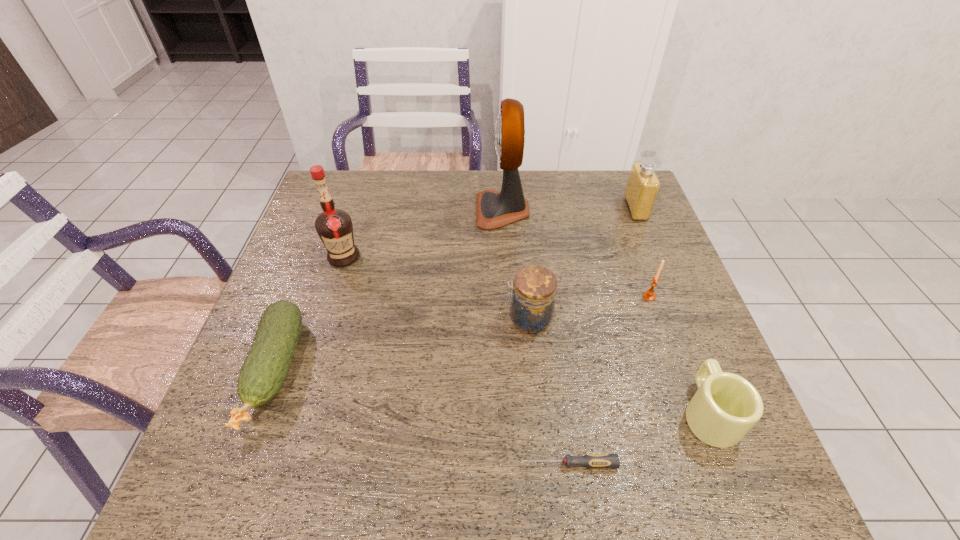
The image size is (960, 540). What are the coordinates of `vacant space that is in between the liquor and the jar` in the screenshot? It's located at (436, 288).

Locate an element on the screen. The height and width of the screenshot is (540, 960). vacant region between the mug and the liquor is located at coordinates (526, 335).

You are a GUI agent. You are given a task and a screenshot of the screen. Output one action in this format:
    pyautogui.click(x=<x>, y=<y>)
    Task: Click on the free area in between the jar and the screwdriver
    The width and height of the screenshot is (960, 540).
    Given the screenshot: What is the action you would take?
    pyautogui.click(x=548, y=392)

Where is `free space between the cucumber and the seventh shortest object`? free space between the cucumber and the seventh shortest object is located at coordinates (309, 314).

Locate which object is the seventh closest to the jar. Please provide its 2D coordinates. Your answer should be formatted as a tuple, i.e. [(x, y)], where the tuple contains the x and y coordinates of a point satisfying the conditions above.

[(263, 373)]

This screenshot has height=540, width=960. In order to click on the fourth closest object to the sixth tallest object in this screenshot , I will do `click(643, 185)`.

Identify the location of free space that satisfies the following two spatial constraints: 1. on the front-facing side of the third tallest object; 2. on the front and back of the third farthest object. (655, 257).

Identify the location of vacant space that satisfies the following two spatial constraints: 1. on the lid of the jar; 2. at the blossom end of the second shortest object. Image resolution: width=960 pixels, height=540 pixels. pyautogui.click(x=533, y=370).

The height and width of the screenshot is (540, 960). Find the location of `vacant region that satisfies the following two spatial constraints: 1. on the front and back of the fifth nearest object; 2. on the right side of the sixth nearest object`. vacant region that satisfies the following two spatial constraints: 1. on the front and back of the fifth nearest object; 2. on the right side of the sixth nearest object is located at coordinates (331, 296).

I want to click on free spot that satisfies the following two spatial constraints: 1. on the back side of the candle_holder; 2. on the front-facing side of the tallest object, so click(x=618, y=210).